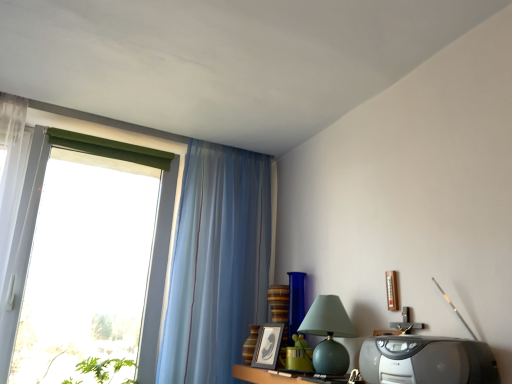
Question: Which direction should I rotate to look at blue glass vase at center, the 2th glass vase when ordered from left to right, — up or down?

Choices:
 (A) up
 (B) down

Answer: (B)

Question: Does matte green glass table lamp at center-right come in front of black matte picture frame at center?

Choices:
 (A) yes
 (B) no

Answer: (A)

Question: Could you tell me if matte green glass table lamp at center-right is facing black matte picture frame at center?

Choices:
 (A) no
 (B) yes

Answer: (A)

Question: Is matte green glass table lamp at center-right not close to black matte picture frame at center?

Choices:
 (A) no
 (B) yes

Answer: (A)

Question: From a real-world perspective, is matte green glass table lamp at center-right physically above black matte picture frame at center?

Choices:
 (A) no
 (B) yes

Answer: (B)

Question: Is matte green glass table lamp at center-right looking in the opposite direction of black matte picture frame at center?

Choices:
 (A) yes
 (B) no

Answer: (B)

Question: Is matte green glass table lamp at center-right shorter than black matte picture frame at center?

Choices:
 (A) yes
 (B) no

Answer: (B)

Question: Can you confirm if translucent blue curtain at left is smaller than blue glass vase at center, the 2th glass vase when ordered from left to right?

Choices:
 (A) no
 (B) yes

Answer: (A)

Question: Is translucent blue curtain at left positioned beyond the bounds of blue glass vase at center, the 2th glass vase when ordered from left to right?

Choices:
 (A) yes
 (B) no

Answer: (A)

Question: From the image's perspective, is translucent blue curtain at left located beneath blue glass vase at center, acting as the first glass vase starting from the right?

Choices:
 (A) no
 (B) yes

Answer: (A)

Question: Considering the relative positions of translucent blue curtain at left and blue glass vase at center, acting as the first glass vase starting from the right, in the image provided, is translucent blue curtain at left to the left of blue glass vase at center, acting as the first glass vase starting from the right, from the viewer's perspective?

Choices:
 (A) yes
 (B) no

Answer: (A)

Question: From a real-world perspective, is translucent blue curtain at left beneath blue glass vase at center, acting as the first glass vase starting from the right?

Choices:
 (A) no
 (B) yes

Answer: (A)

Question: From a real-world perspective, is translucent blue curtain at left positioned over blue glass vase at center, acting as the first glass vase starting from the right, based on gravity?

Choices:
 (A) no
 (B) yes

Answer: (B)

Question: Is black matte picture frame at center far from matte green glass table lamp at center-right?

Choices:
 (A) yes
 (B) no

Answer: (B)